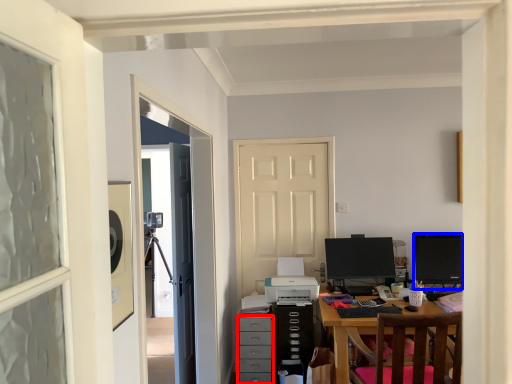
Question: Which point is closer to the camera, drawer (highlighted by a red box) or computer monitor (highlighted by a blue box)?

Choices:
 (A) drawer
 (B) computer monitor

Answer: (A)